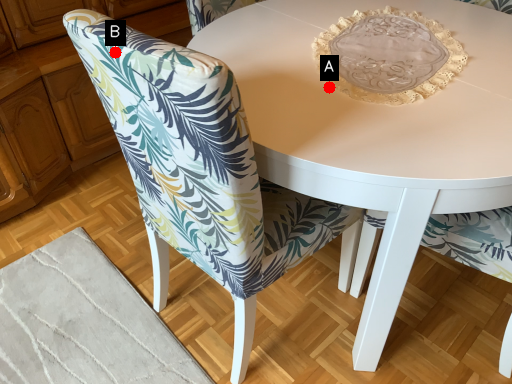
Question: Two points are circled on the image, labeled by A and B beside each circle. Among these points, which one is nearest to the camera?

Choices:
 (A) A is closer
 (B) B is closer

Answer: (B)